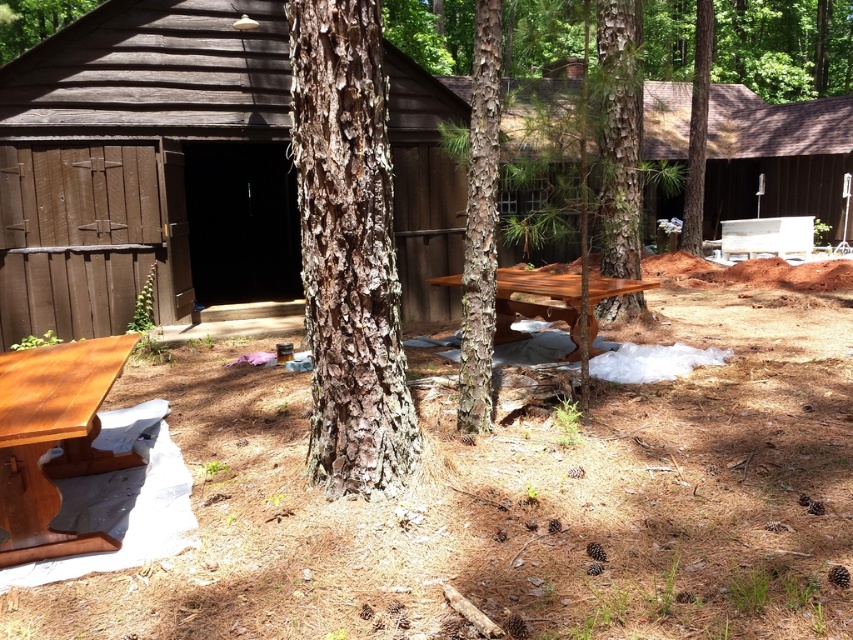
Question: Is brown wood cabin at center above light brown wood table at lower left?

Choices:
 (A) no
 (B) yes

Answer: (B)

Question: Does brown wood cabin at center appear over brown rough bark tree at center?

Choices:
 (A) no
 (B) yes

Answer: (B)

Question: Which object is the farthest from the smooth reddish-brown wood picnic table at center?

Choices:
 (A) grayish-brown bark tree at center
 (B) light brown wood table at lower left
 (C) smooth bark tree at center

Answer: (C)

Question: Which object appears closest to the camera in this image?

Choices:
 (A) brown rough bark tree at upper left
 (B) grayish-brown bark tree at center

Answer: (B)

Question: Is brown rough bark tree at center to the right of smooth bark tree at center from the viewer's perspective?

Choices:
 (A) no
 (B) yes

Answer: (A)

Question: Which point is farther to the camera?

Choices:
 (A) grayish-brown bark tree at center
 (B) brown rough bark tree at upper left
 (C) white painted wood bench at center right

Answer: (B)